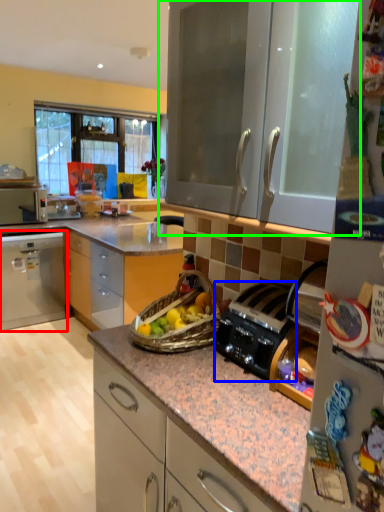
Question: Considering the real-world distances, which object is farthest from cabinetry (highlighted by a red box)? kitchen appliance (highlighted by a blue box) or cabinetry (highlighted by a green box)?

Choices:
 (A) kitchen appliance
 (B) cabinetry

Answer: (A)